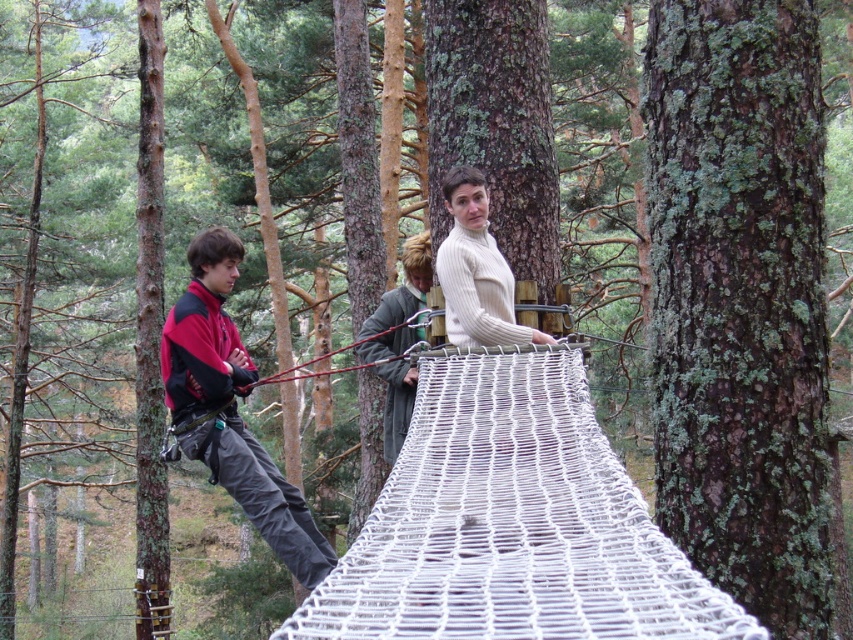
Which of these two, red fleece jacket at left or white ribbed sweater at center, stands taller?

red fleece jacket at left is taller.

Does point (218, 339) come farther from viewer compared to point (496, 289)?

No, (218, 339) is closer to viewer.

Is point (207, 372) less distant than point (453, 195)?

Yes, it is.

Locate an element on the screen. red fleece jacket at left is located at coordinates (230, 408).

Who is shorter, brown rough bark at center or red fleece jacket at left?

With less height is red fleece jacket at left.

Is point (715, 236) closer to viewer compared to point (204, 461)?

Yes, it is.

Identify the location of brown rough bark at center. The width and height of the screenshot is (853, 640). (740, 300).

Does brown rough bark at center appear on the right side of white ribbed sweater at center?

Correct, you'll find brown rough bark at center to the right of white ribbed sweater at center.

Is brown rough bark at center above white ribbed sweater at center?

No.

Which is behind, point (682, 500) or point (482, 301)?

The point (482, 301) is more distant.

The image size is (853, 640). In order to click on brown rough bark at center in this screenshot , I will do `click(740, 300)`.